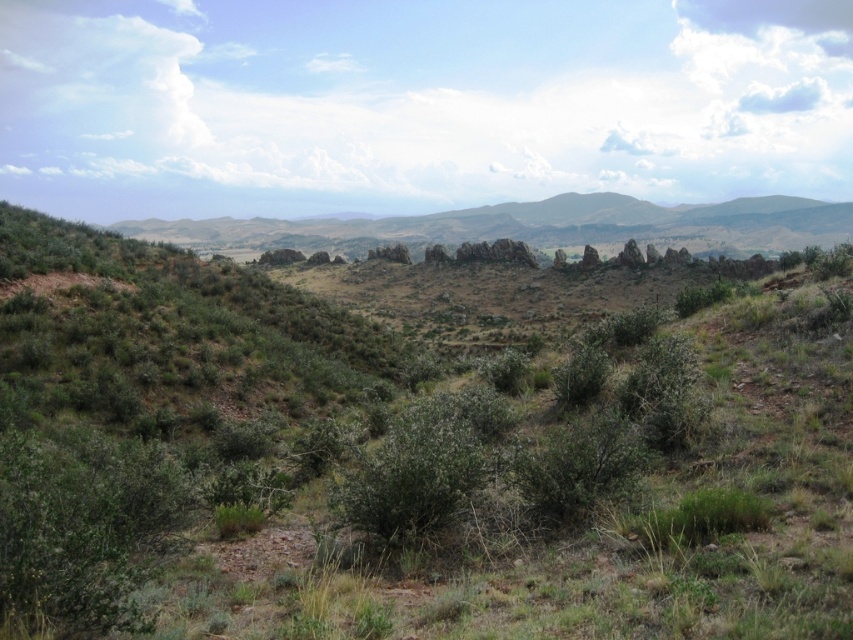
Is green shrubbery at center smaller than green grassy mountain at center?

Indeed, green shrubbery at center has a smaller size compared to green grassy mountain at center.

Who is taller, green shrubbery at center or green grassy mountain at center?

green grassy mountain at center is taller.

Does point (490, 461) come in front of point (254, 225)?

Yes, point (490, 461) is closer to viewer.

Find the location of a particular element. green shrubbery at center is located at coordinates (410, 449).